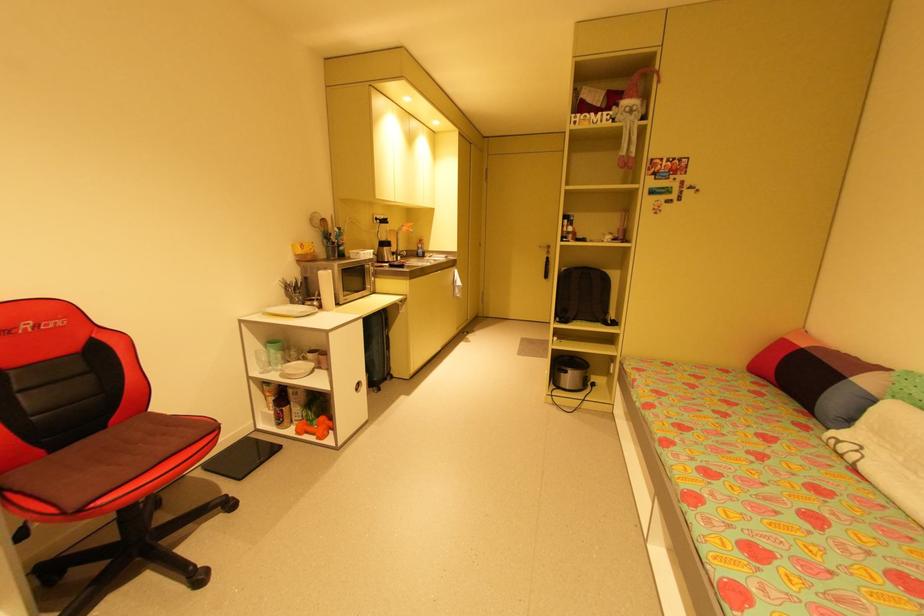
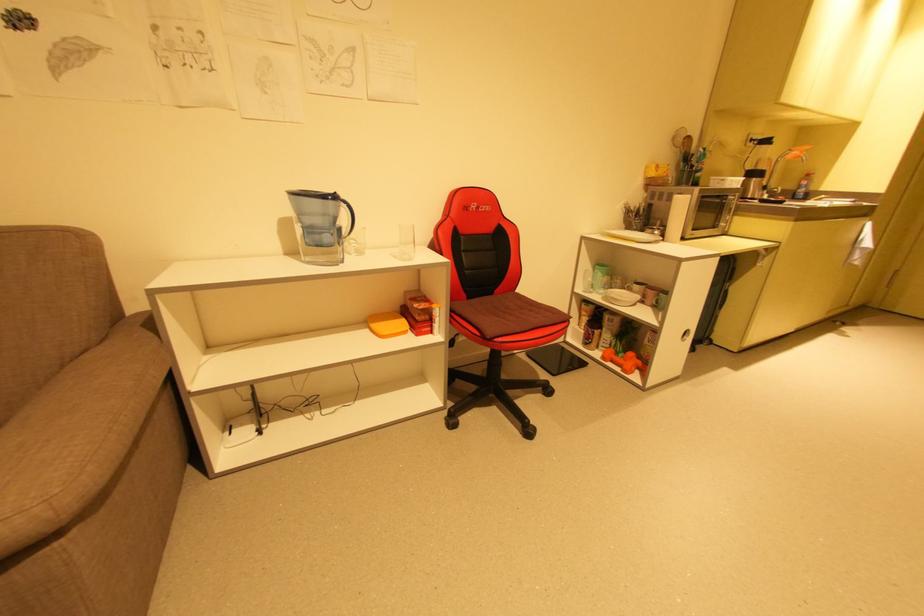
In the second image, find the point that corresponds to (x=412, y=227) in the first image.

(805, 152)